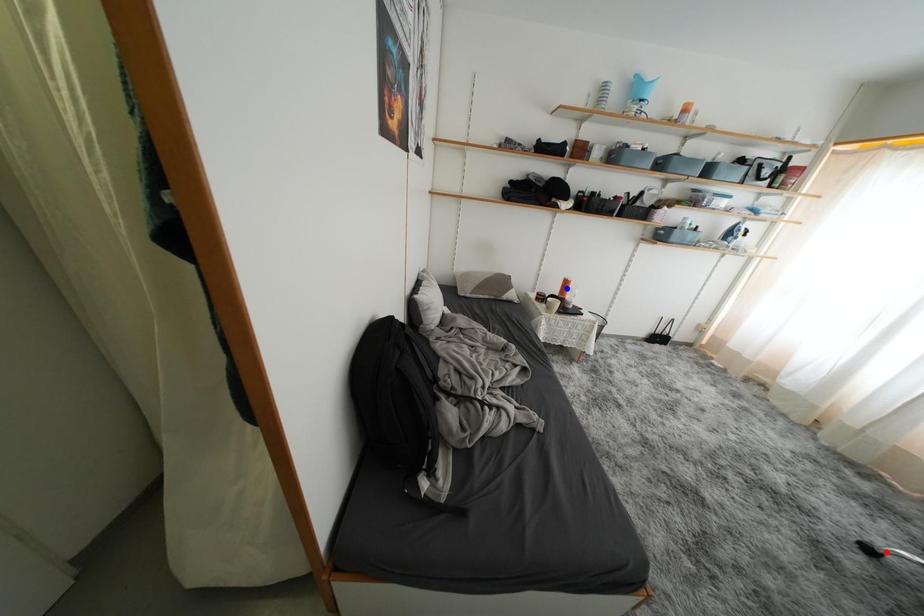
Question: Two points are marked on the image. Which point is closer to the camera?

Choices:
 (A) Blue point is closer.
 (B) Red point is closer.

Answer: (B)